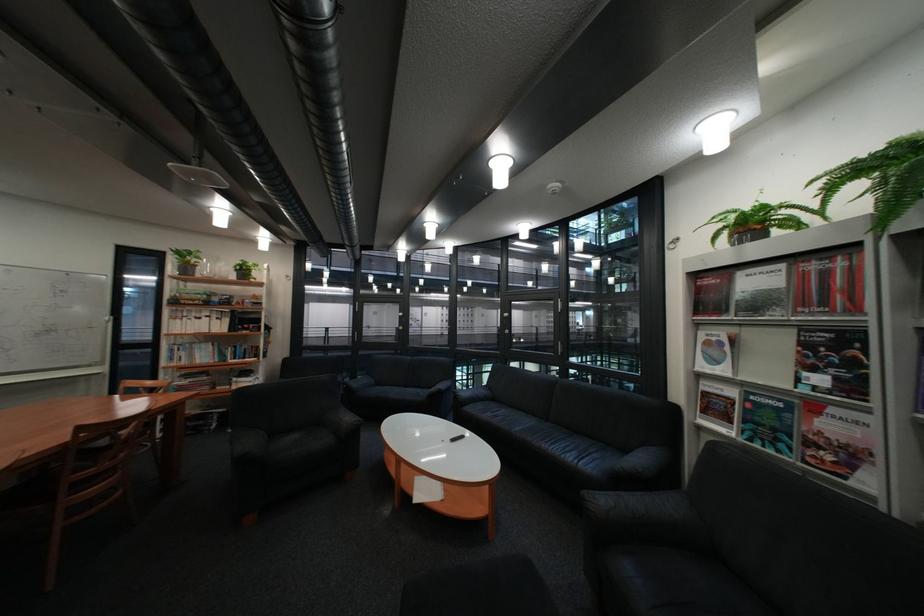
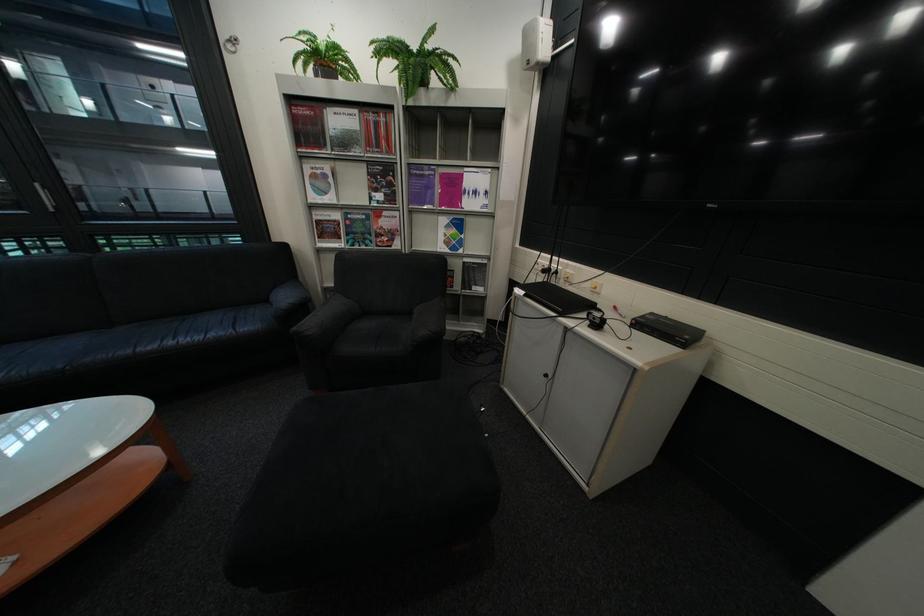
Where in the second image is the point corresponding to point 723,342 from the first image?

(329, 177)